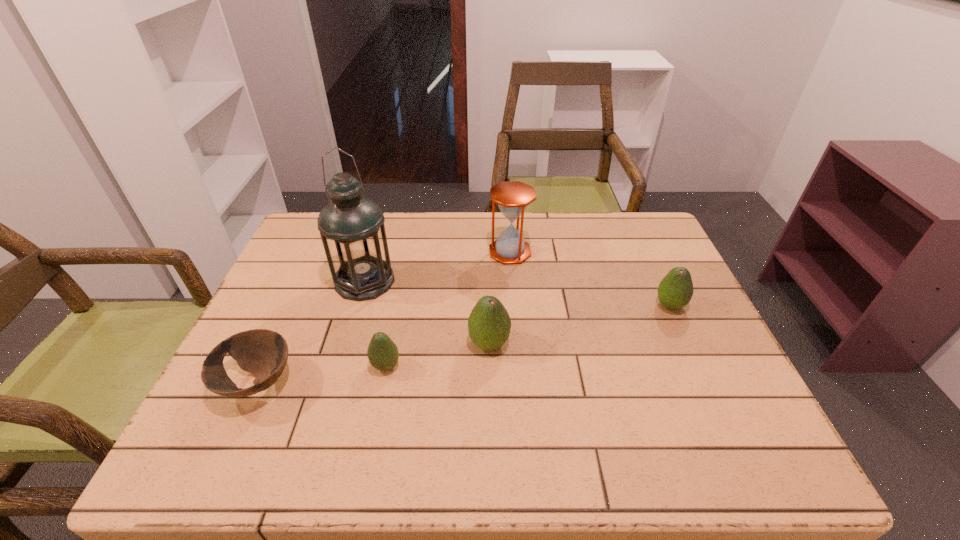
The height and width of the screenshot is (540, 960). Find the location of `the leftmost avocado`. the leftmost avocado is located at coordinates (383, 355).

Identify the location of the third tallest object. The height and width of the screenshot is (540, 960). (489, 324).

This screenshot has height=540, width=960. In order to click on the tallest avocado in this screenshot , I will do `click(489, 324)`.

Where is `the fourth tallest object`? the fourth tallest object is located at coordinates (675, 290).

What are the coordinates of `the rightmost object` in the screenshot? It's located at (675, 290).

Image resolution: width=960 pixels, height=540 pixels. I want to click on the second tallest object, so click(513, 197).

Identify the location of oil lamp. This screenshot has height=540, width=960. (351, 226).

This screenshot has width=960, height=540. I want to click on bowl, so click(264, 353).

The width and height of the screenshot is (960, 540). Find the location of `vacant area located on the back of the shortest avocado`. vacant area located on the back of the shortest avocado is located at coordinates (396, 314).

Locate an element on the screen. The height and width of the screenshot is (540, 960). free location located 0.310m on the right of the tallest avocado is located at coordinates (640, 344).